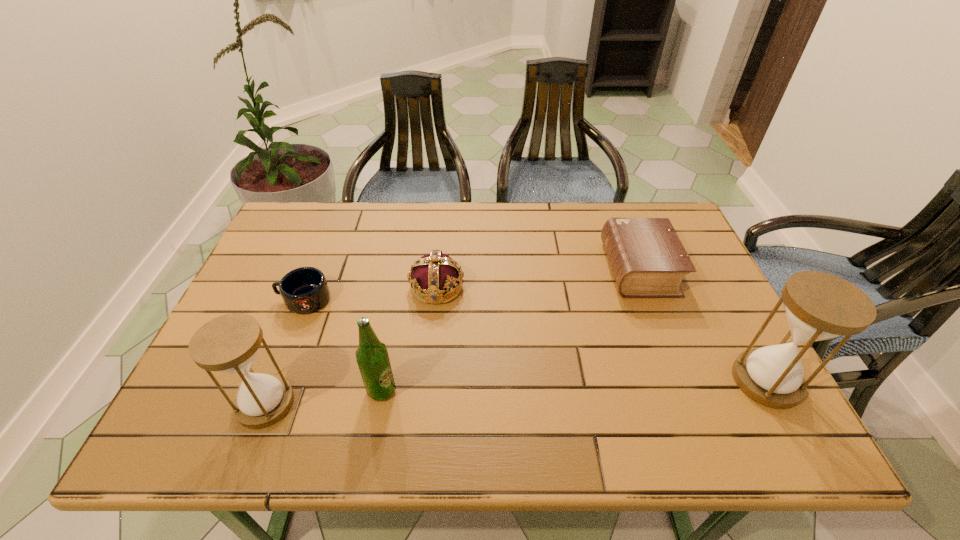
Find the location of `mug that is at the left edge`. mug that is at the left edge is located at coordinates (304, 290).

This screenshot has height=540, width=960. I want to click on hourglass present at the right edge, so click(x=819, y=306).

The width and height of the screenshot is (960, 540). What are the coordinates of `Bible that is at the right edge` in the screenshot? It's located at (648, 260).

The width and height of the screenshot is (960, 540). I want to click on object that is at the near left corner, so click(x=229, y=343).

The width and height of the screenshot is (960, 540). What are the coordinates of `object that is at the far right corner` in the screenshot? It's located at (648, 260).

You are a GUI agent. You are given a task and a screenshot of the screen. Output one action in this format:
    pyautogui.click(x=<x>, y=<y>)
    Task: Click on the object that is positioned at the near right corner
    
    Given the screenshot: What is the action you would take?
    pyautogui.click(x=819, y=306)

You are a GUI agent. You are given a task and a screenshot of the screen. Output one action in this format:
    pyautogui.click(x=<x>, y=<y>)
    Task: Click on the free space at the far edge of the desktop
    
    Given the screenshot: What is the action you would take?
    pyautogui.click(x=419, y=229)

In the image, there is a desktop. Where is `blank space at the near edge`? blank space at the near edge is located at coordinates tap(475, 396).

The height and width of the screenshot is (540, 960). In the image, there is a desktop. In order to click on vacant space at the left edge in this screenshot , I will do `click(271, 318)`.

Where is `free space at the right edge of the desktop`? free space at the right edge of the desktop is located at coordinates (702, 305).